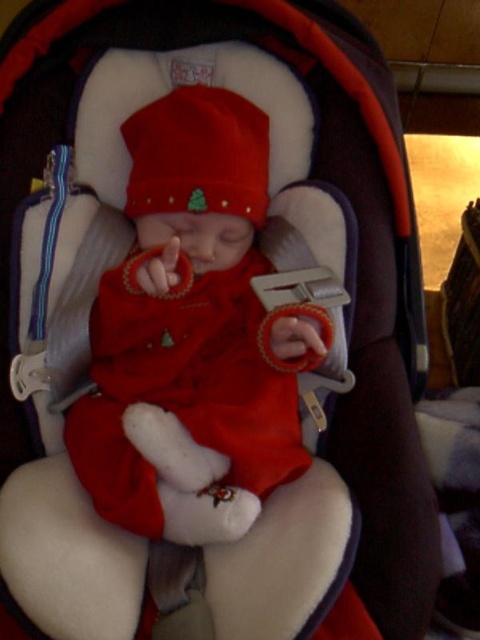
You are a photographer taking a closeup shot of the baby in the car seat. You need to focus on both the matte red fabric baby at center and the matte red knit hat at center. Which object should you adjust your focus to first if you want to ensure both are in focus, considering their sizes?

The matte red fabric baby at center is taller than the matte red knit hat at center, so you should focus on the matte red fabric baby at center first to ensure both are in focus.

You are a photographer trying to capture a closeup of the baby in the car seat. The car seat has a safety strap that is in the way of the perfect shot. You notice a point at coordinates (192, 333). What object is located at this point?

The point at coordinates (192, 333) corresponds to the matte red fabric baby at center.

You are a photographer taking a picture of the baby in the car seat. You notice two points marked on the image at coordinates point (156, 144) and point (154, 170). Which point is closer to the camera?

Point (156, 144) is closer to the camera than point (154, 170).